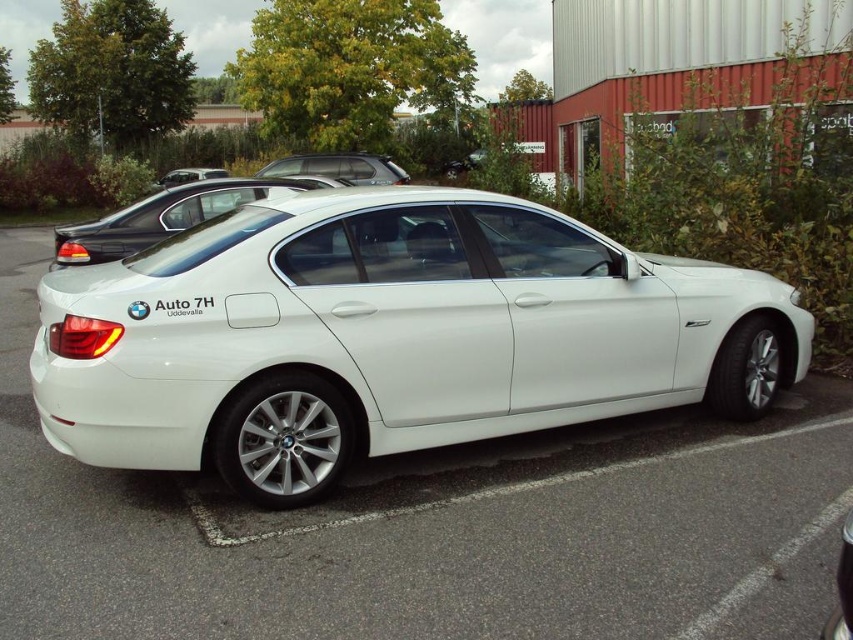
You are a parking attendant who needs to determine if a delivery truck can pass between the white metallic car at center and the matte black car at upper center. The truck is 2 meters tall. Can the truck pass through the space between them?

The white metallic car at center is taller than the matte black car at upper center. Since the truck is 2 meters tall, it depends on the height of the lower car. However, without specific height measurements, we cannot confirm if the truck can pass. Please provide the height of the matte black car at upper center.

You are a parking attendant and need to guide a customer to park their car between the satin silver suv at upper center and the matte black car at upper center. Considering the space between them, will the customer be able to park their compact car that is 1.8 meters wide?

The satin silver suv at upper center is thinner than the matte black car at upper center, but without specific measurements of the space between them, it is impossible to determine if the compact car will fit. Please measure the gap before proceeding.